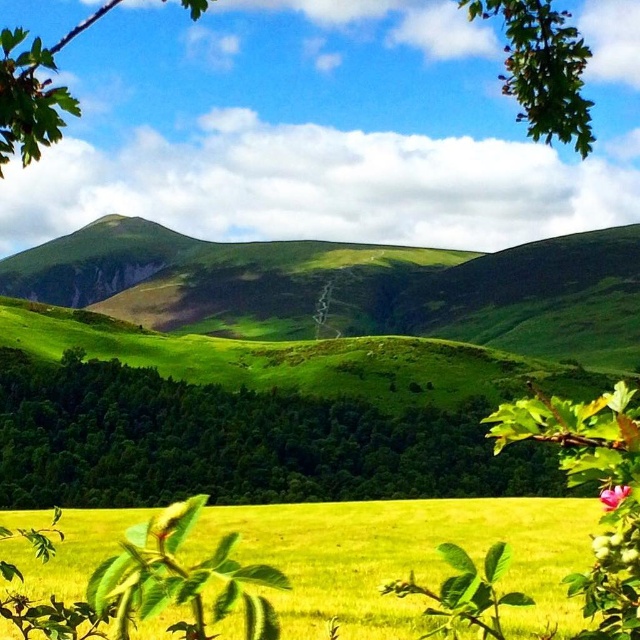
Locate an element on the screen. green leafy tree at lower left is located at coordinates (236, 442).

Is point (225, 440) farther from viewer compared to point (608, 509)?

That is True.

Identify the location of green leafy tree at lower left. The width and height of the screenshot is (640, 640). click(x=236, y=442).

Find the location of a particular element. green leafy tree at lower left is located at coordinates (236, 442).

Is point (484, 515) closer to camera compared to point (532, 72)?

No, it is behind (532, 72).

The width and height of the screenshot is (640, 640). Describe the element at coordinates (404, 557) in the screenshot. I see `yellow grass at center` at that location.

Is point (54, 582) more distant than point (10, 106)?

Yes, point (54, 582) is behind point (10, 106).

Where is `yellow grass at center`? The image size is (640, 640). yellow grass at center is located at coordinates (404, 557).

This screenshot has height=640, width=640. What are the coordinates of `yellow grass at center` in the screenshot? It's located at (404, 557).

Is yellow grass at center smaller than pink matte flower at lower right?

No, yellow grass at center is not smaller than pink matte flower at lower right.

Which is in front, point (396, 634) or point (609, 500)?

Point (609, 500) is more forward.

Image resolution: width=640 pixels, height=640 pixels. What are the coordinates of `yellow grass at center` in the screenshot? It's located at (404, 557).